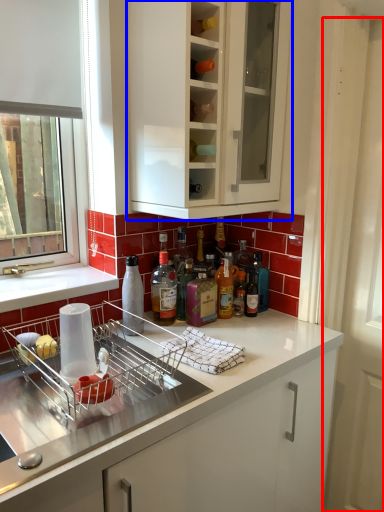
Question: Which point is closer to the camera, screen door (highlighted by a red box) or cabinetry (highlighted by a blue box)?

Choices:
 (A) screen door
 (B) cabinetry

Answer: (B)